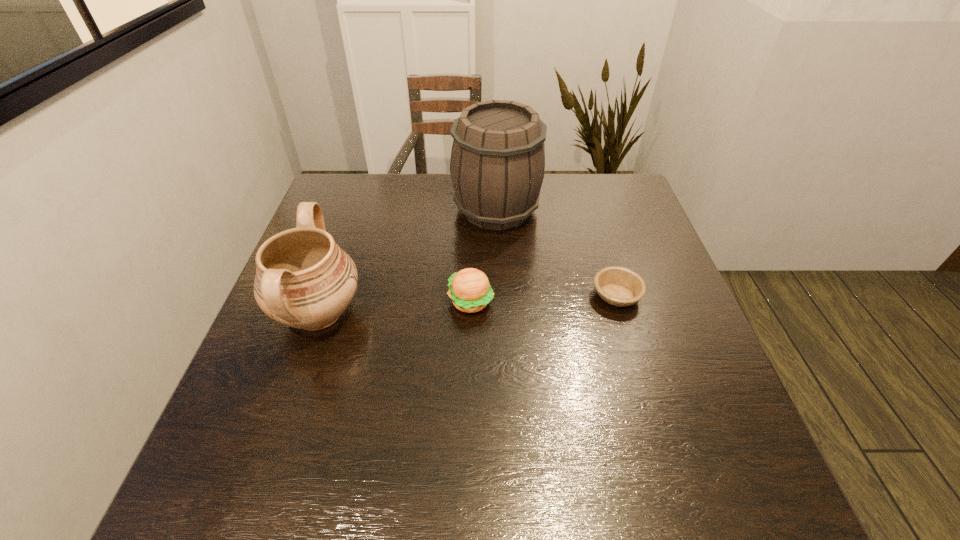
This screenshot has width=960, height=540. Identify the location of vacant space at the far right corner of the desktop. (631, 180).

Where is `vacant space that's between the urn and the tallest object`? vacant space that's between the urn and the tallest object is located at coordinates (408, 261).

Where is `empty space that is in between the wine bucket and the hamburger`? empty space that is in between the wine bucket and the hamburger is located at coordinates (484, 255).

This screenshot has width=960, height=540. In order to click on free space between the third shortest object and the farthest object in this screenshot , I will do `click(408, 261)`.

Image resolution: width=960 pixels, height=540 pixels. Find the location of `free area in between the second tallest object and the farthest object`. free area in between the second tallest object and the farthest object is located at coordinates (408, 261).

I want to click on unoccupied area between the third shortest object and the second shortest object, so click(x=395, y=307).

Where is `free space between the farthest object and the rightmost object`? The width and height of the screenshot is (960, 540). free space between the farthest object and the rightmost object is located at coordinates (557, 252).

At what (x,y) coordinates should I click in order to perform the action: click on free space between the hamburger and the tallest object. Please return your answer as a coordinate pair (x, y). This screenshot has height=540, width=960. Looking at the image, I should click on (484, 255).

Locate which object is the closest to the urn. Please provide its 2D coordinates. Your answer should be formatted as a tuple, i.e. [(x, y)], where the tuple contains the x and y coordinates of a point satisfying the conditions above.

[(470, 290)]

Where is `object that is the third closest to the tallest object`? This screenshot has width=960, height=540. object that is the third closest to the tallest object is located at coordinates (304, 280).